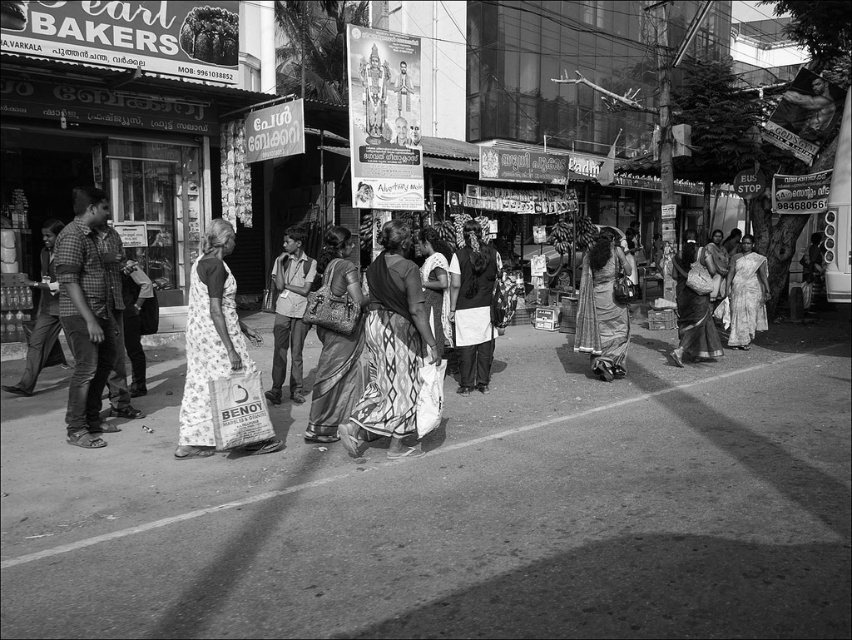
Question: Is sari at center to the right of white floral saree at right from the viewer's perspective?

Choices:
 (A) yes
 (B) no

Answer: (A)

Question: Which object is closer to the camera taking this photo?

Choices:
 (A) printed cotton saree at center
 (B) silky white saree at center
 (C) floral cotton sari at center

Answer: (C)

Question: Estimate the real-world distances between objects in this image. Which object is closer to the printed cotton saree at center?

Choices:
 (A) dark gray fabric sari at center
 (B) sari at center

Answer: (A)

Question: Which of the following is the closest to the observer?

Choices:
 (A) (763, 328)
 (B) (245, 355)

Answer: (B)

Question: Does printed cotton saree at center come in front of white floral saree at right?

Choices:
 (A) yes
 (B) no

Answer: (A)

Question: Does silky gold saree at center have a larger size compared to sari at center?

Choices:
 (A) yes
 (B) no

Answer: (B)